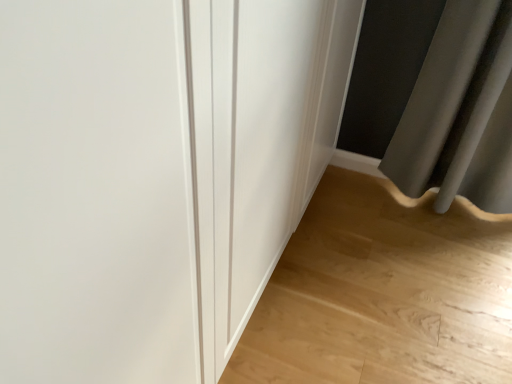
Locate an element on the screen. free space above light wood floor at lower right (from a real-world perspective) is located at coordinates (377, 308).